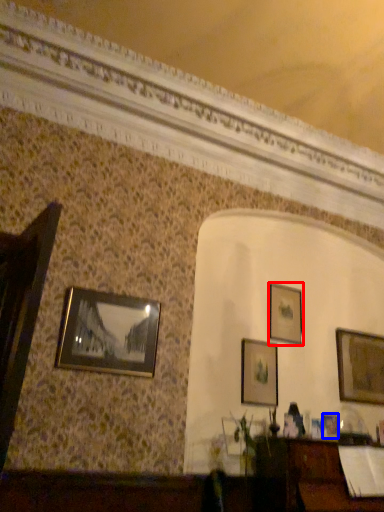
Question: Which of the following is the farthest to the observer, picture frame (highlighted by a red box) or picture frame (highlighted by a blue box)?

Choices:
 (A) picture frame
 (B) picture frame

Answer: (A)